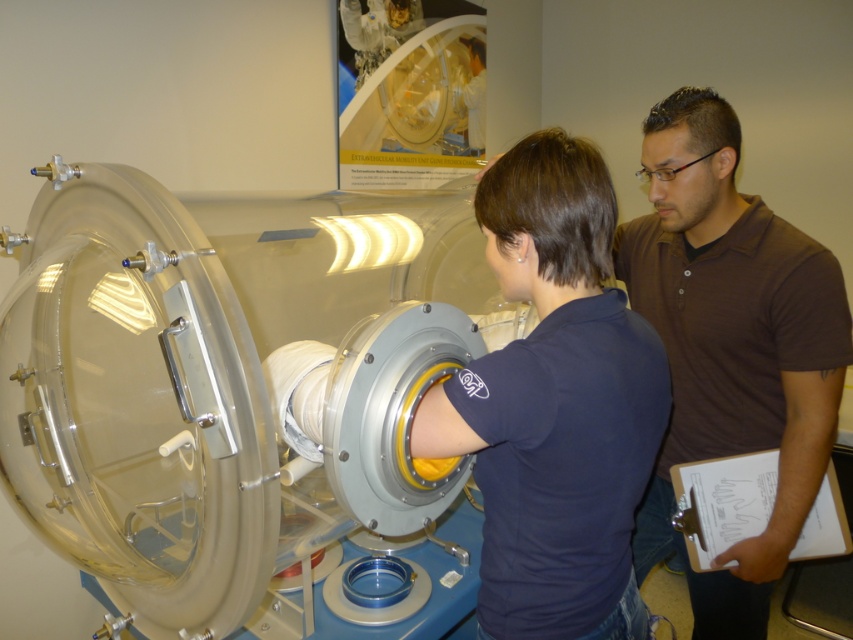
Which is more to the left, transparent plastic cylinder at center or brown smooth shirt at center?

transparent plastic cylinder at center is more to the left.

Can you confirm if transparent plastic cylinder at center is positioned below brown smooth shirt at center?

Indeed, transparent plastic cylinder at center is positioned under brown smooth shirt at center.

Is point (463, 305) positioned before point (793, 452)?

No, (463, 305) is further to viewer.

I want to click on transparent plastic cylinder at center, so coord(238,394).